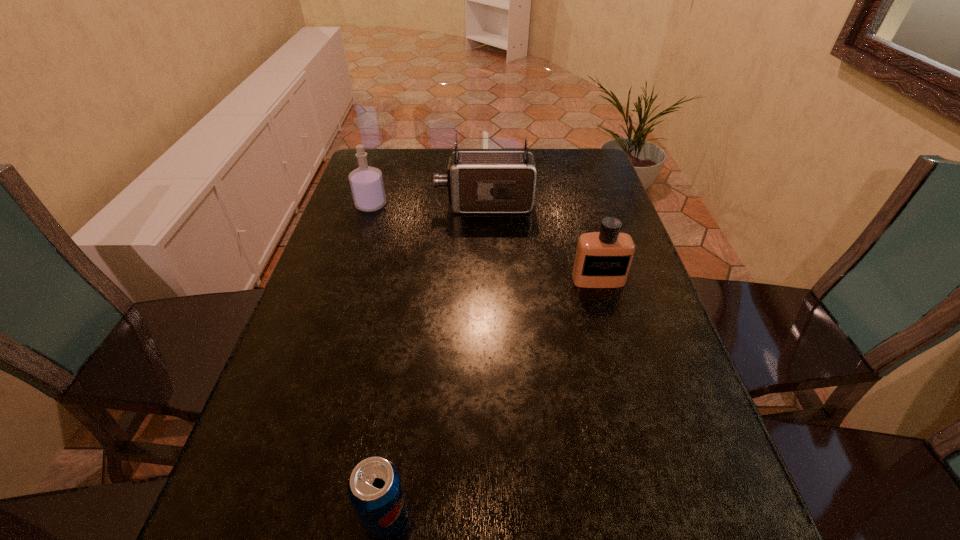
You are a GUI agent. You are given a task and a screenshot of the screen. Output one action in this format:
    pyautogui.click(x=<x>, y=<y>)
    Task: Click on the vacant area that lies between the nearer perfume and the camcorder
    The width and height of the screenshot is (960, 540).
    Given the screenshot: What is the action you would take?
    pyautogui.click(x=541, y=242)

Image resolution: width=960 pixels, height=540 pixels. Identify the location of free space between the nearer perfume and the camcorder. [x=541, y=242].

At what (x,y) coordinates should I click in order to perform the action: click on free spot between the third farthest object and the camcorder. Please return your answer as a coordinate pair (x, y). Looking at the image, I should click on (541, 242).

I want to click on object that is the closest to the left perfume, so click(x=478, y=181).

Locate which object is the second closest to the left perfume. Please provide its 2D coordinates. Your answer should be formatted as a tuple, i.e. [(x, y)], where the tuple contains the x and y coordinates of a point satisfying the conditions above.

[(603, 259)]